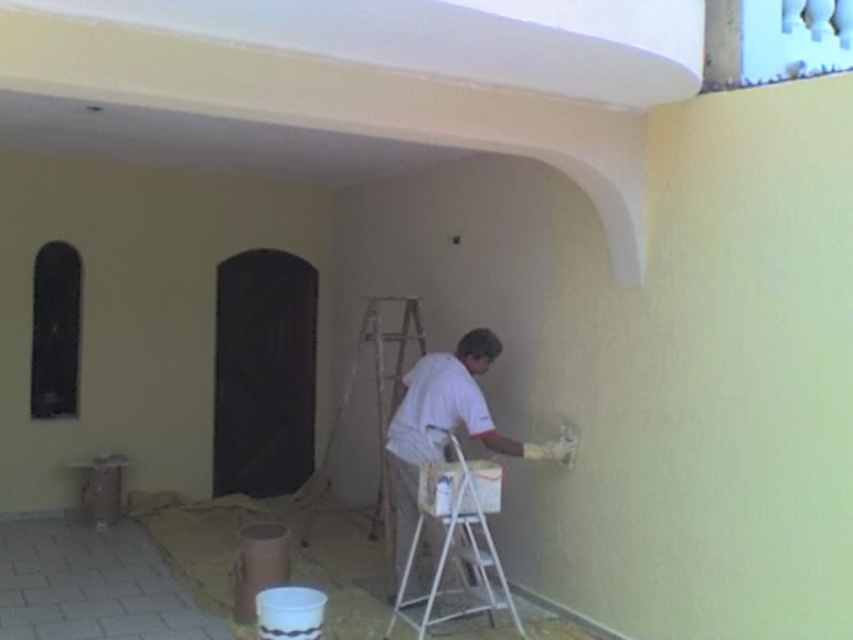
You are standing in the room and want to place a small plant between the two points, point (405,518) and point (476,492). Which point should the plant be closer to if you want it to be nearer to the camera?

The plant should be closer to point (405,518) because it is further to the camera than point (476,492).

You are a painter standing at the point with coordinates (445,426) in the room. You need to reach the window with a dark frame on the left side. Which direction should you move to get closer to the window?

The white matte shirt at center is represented by point (445,426). Since the window with a dark frame is on the left side of the image, you should move to the left to get closer to the window.